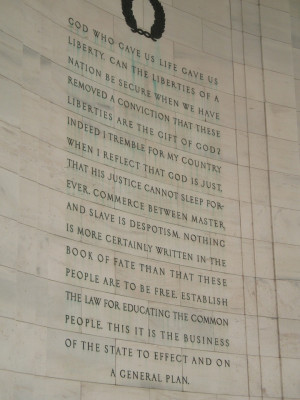
Image resolution: width=300 pixels, height=400 pixels. I want to click on marble wall, so click(x=272, y=28), click(x=276, y=51), click(x=288, y=258), click(x=275, y=119).